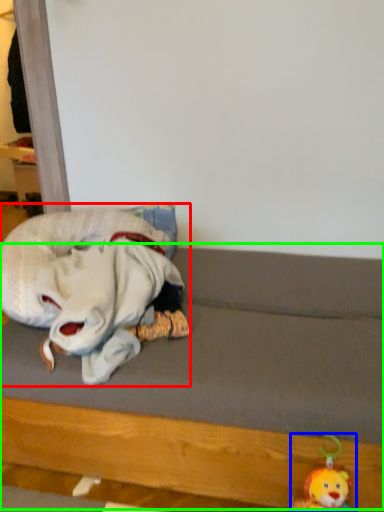
Question: Based on their relative distances, which object is farther from toy (highlighted by a red box)? Choose from toy (highlighted by a blue box) and bed frame (highlighted by a green box).

Choices:
 (A) toy
 (B) bed frame

Answer: (A)